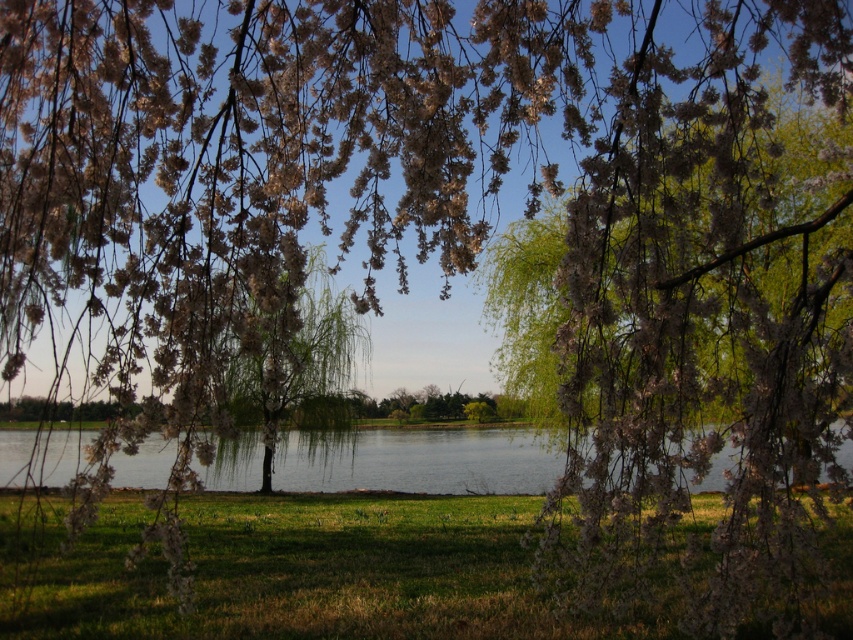
You are a photographer planning to capture the reflection of the green leafy willow at center in the clear water at center. Based on the scene, will the reflection be fully visible in the water?

The clear water at center has a lesser height compared to green leafy willow at center, so the reflection of the green leafy willow at center may not be fully visible in the clear water at center because the water is shorter in height than the willow.

You are standing in the serene outdoor scene and want to take a photo of the clear water at center and the green leafy willow at center. Which object is positioned to the left of the other?

The clear water at center is to the left of the green leafy willow at center.